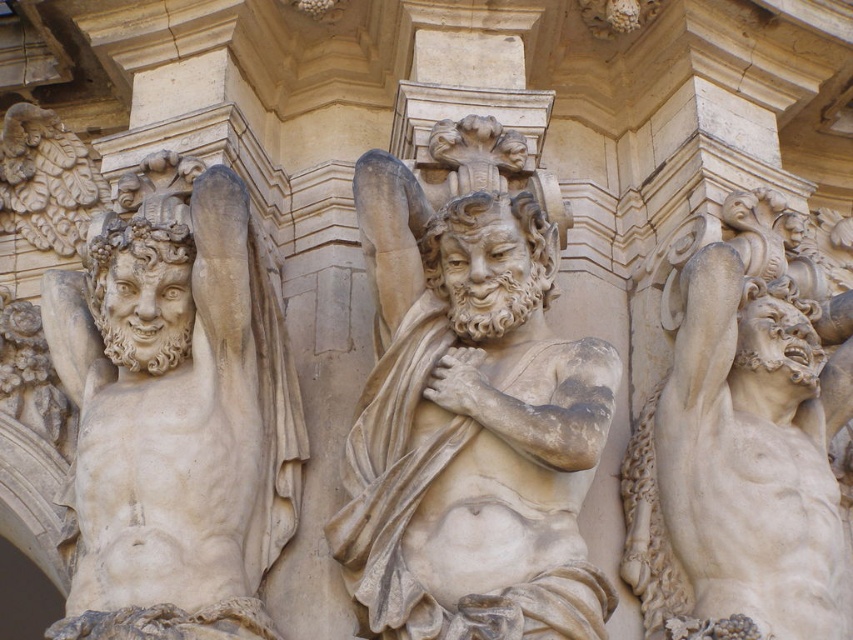
In the scene shown: Between beige stone figure at center and matte stone figure at left, which one is positioned higher?

Positioned higher is beige stone figure at center.

I want to click on beige stone figure at center, so [469, 426].